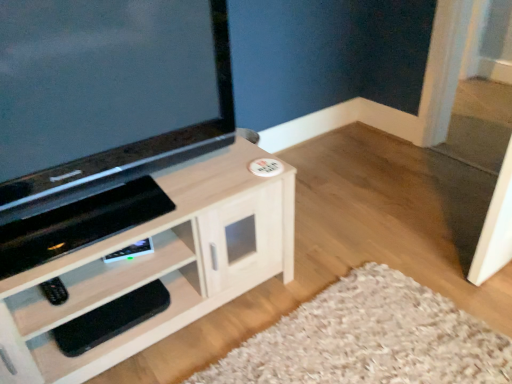
Question: From a real-world perspective, is black rubber footrest at lower left beneath light wood cabinet at center?

Choices:
 (A) yes
 (B) no

Answer: (A)

Question: Is light wood cabinet at center completely or partially inside black rubber footrest at lower left?

Choices:
 (A) yes
 (B) no

Answer: (B)

Question: Is black rubber footrest at lower left taller than light wood cabinet at center?

Choices:
 (A) yes
 (B) no

Answer: (B)

Question: Is black rubber footrest at lower left wider than light wood cabinet at center?

Choices:
 (A) yes
 (B) no

Answer: (B)

Question: Considering the relative sizes of black rubber footrest at lower left and light wood cabinet at center in the image provided, is black rubber footrest at lower left thinner than light wood cabinet at center?

Choices:
 (A) no
 (B) yes

Answer: (B)

Question: From a real-world perspective, is matte black tv at upper left physically located above or below black rubber footrest at lower left?

Choices:
 (A) below
 (B) above

Answer: (B)

Question: Is matte black tv at upper left bigger or smaller than black rubber footrest at lower left?

Choices:
 (A) big
 (B) small

Answer: (A)

Question: From the image's perspective, relative to black rubber footrest at lower left, is matte black tv at upper left above or below?

Choices:
 (A) below
 (B) above

Answer: (B)

Question: Considering the positions of matte black tv at upper left and black rubber footrest at lower left in the image, is matte black tv at upper left wider or thinner than black rubber footrest at lower left?

Choices:
 (A) wide
 (B) thin

Answer: (A)

Question: Based on their positions, is light wood cabinet at center located to the left or right of black rubber footrest at lower left?

Choices:
 (A) left
 (B) right

Answer: (B)

Question: Choose the correct answer: Is light wood cabinet at center inside black rubber footrest at lower left or outside it?

Choices:
 (A) inside
 (B) outside

Answer: (B)

Question: From a real-world perspective, is light wood cabinet at center above or below black rubber footrest at lower left?

Choices:
 (A) above
 (B) below

Answer: (A)

Question: From the image's perspective, is light wood cabinet at center located above or below black rubber footrest at lower left?

Choices:
 (A) below
 (B) above

Answer: (B)

Question: Is black matte remote at lower left inside or outside of matte black tv at upper left?

Choices:
 (A) inside
 (B) outside

Answer: (B)

Question: From the image's perspective, is black matte remote at lower left positioned above or below matte black tv at upper left?

Choices:
 (A) above
 (B) below

Answer: (B)